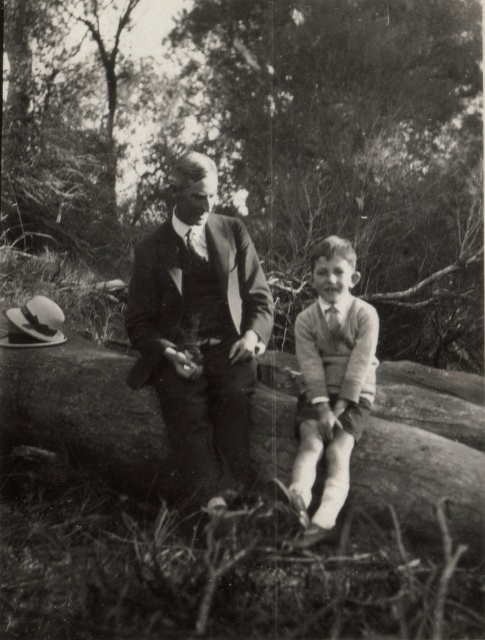
You are planning to hang a 30 feet long rope between the smooth bark tree trunk at center and the camera. Will the rope be long enough to stretch between them?

The smooth bark tree trunk at center and camera are 28.78 feet apart from each other. Since the rope is 30 feet long, it will be long enough to stretch between them with some extra length remaining.

Based on the scene description, which object is wider, the smooth bark tree trunk at center or the knitted sweater at center?

The smooth bark tree trunk at center is wider than the knitted sweater at center according to the description.

You are planning to borrow a jacket from either the smooth suit at center or the knitted sweater at center. Which one would you choose if you want a wider jacket?

The smooth suit at center has a larger width than the knitted sweater at center, so you should choose the smooth suit at center for a wider jacket.